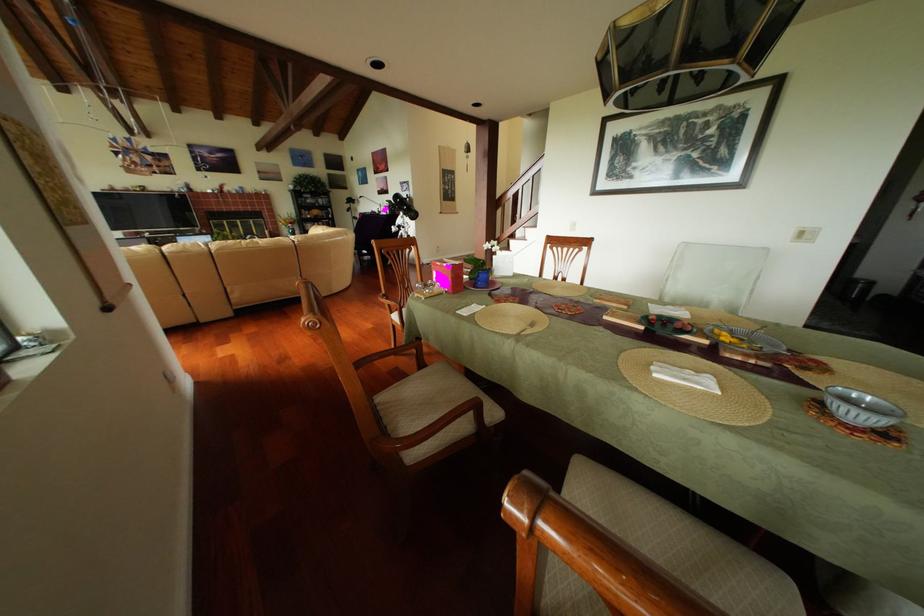
What are the coordinates of `clear glass bowl` in the screenshot? It's located at (860, 408).